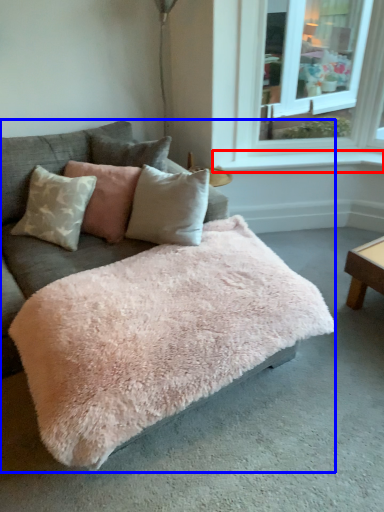
Question: Which of the following is the farthest to the observer, window sill (highlighted by a red box) or studio couch (highlighted by a blue box)?

Choices:
 (A) window sill
 (B) studio couch

Answer: (A)